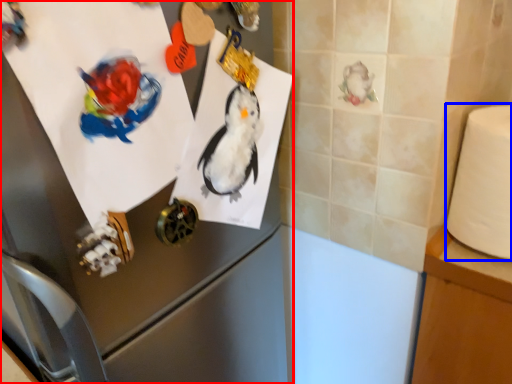
Question: Which object appears farthest to the camera in this image, appliance (highlighted by a red box) or toilet paper (highlighted by a blue box)?

Choices:
 (A) appliance
 (B) toilet paper

Answer: (B)